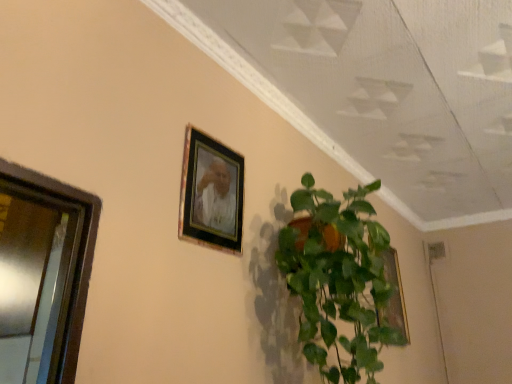
Question: Considering the positions of wooden frame at upper center, the 1th picture frame positioned from the top, and metallic glass window at left in the image, is wooden frame at upper center, the 1th picture frame positioned from the top, taller or shorter than metallic glass window at left?

Choices:
 (A) tall
 (B) short

Answer: (B)

Question: Looking at the image, does wooden frame at upper center, the 1th picture frame positioned from the top, seem bigger or smaller compared to metallic glass window at left?

Choices:
 (A) small
 (B) big

Answer: (A)

Question: Which of these objects is positioned closest to the wooden frame at upper center, which is the first picture frame from front to back?

Choices:
 (A) gold metallic picture frame at upper right, the first picture frame viewed from the right
 (B) metallic glass window at left
 (C) green glossy plant at center

Answer: (C)

Question: Which is nearer to the wooden frame at upper center, the 1th picture frame positioned from the top?

Choices:
 (A) gold metallic picture frame at upper right, the 2th picture frame when ordered from left to right
 (B) metallic glass window at left
 (C) green glossy plant at center

Answer: (C)